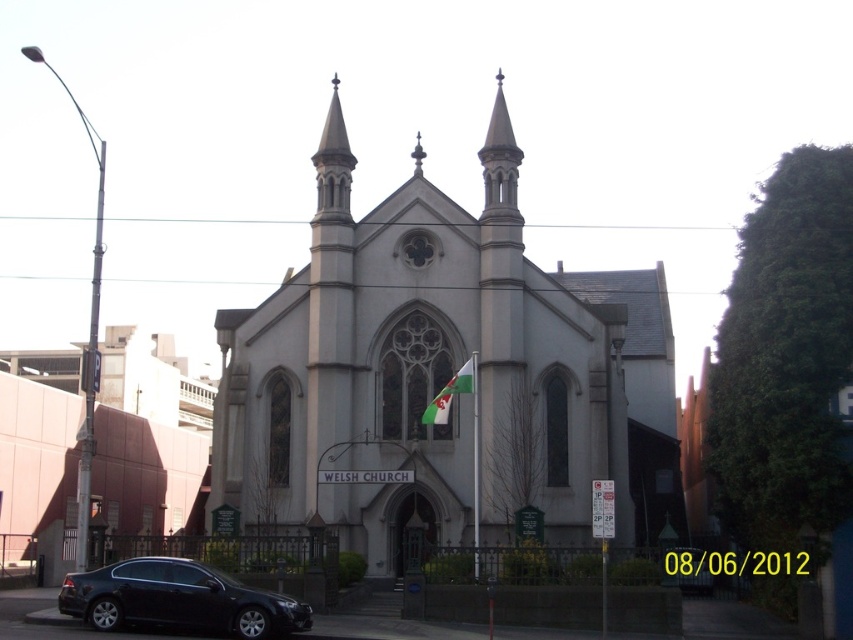
You are a tourist standing in front of the white stone church at center and want to take a photo of the matte black sedan at lower left parked nearby. Can you see the sedan clearly from your current position?

The white stone church at center is positioned over the matte black sedan at lower left, so the church may block your view of the sedan. Move to a different angle to ensure the sedan is fully visible.

You are standing at the base of the flagpole in front of the Gothic Welsh church. You want to take a photo of the smooth gray spire at center without any obstructions. The camera you have can focus on objects up to 300 feet away. Will the spire be in focus?

The smooth gray spire at center and viewer are 339.94 feet apart from each other. Since the camera can only focus up to 300 feet, the spire is beyond the camera range and will not be in focus.